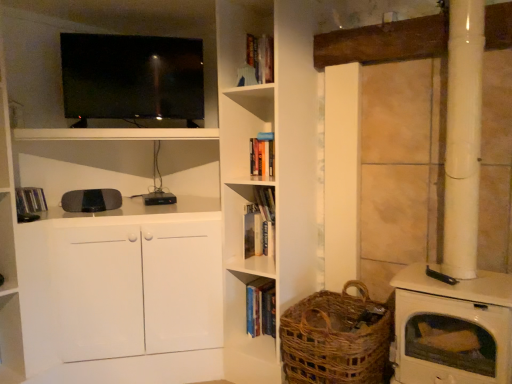
Image resolution: width=512 pixels, height=384 pixels. What do you see at coordinates (30, 200) in the screenshot?
I see `hardcover book at left, which is the 3th book in right-to-left order` at bounding box center [30, 200].

What do you see at coordinates (260, 224) in the screenshot? This screenshot has height=384, width=512. I see `hardcover book at center, which ranks as the second book in left-to-right order` at bounding box center [260, 224].

Describe the element at coordinates (335, 338) in the screenshot. This screenshot has height=384, width=512. I see `woven brown basket at lower right` at that location.

Describe the element at coordinates (131, 76) in the screenshot. This screenshot has height=384, width=512. I see `matte black tv at upper left` at that location.

This screenshot has height=384, width=512. I want to click on hardcover book at left, positioned as the first book in top-to-bottom order, so click(30, 200).

Which is more to the left, hardcover book at center, the second book in the bottom-to-top sequence, or hardcover book at left, positioned as the first book in top-to-bottom order?

hardcover book at left, positioned as the first book in top-to-bottom order, is more to the left.

Is point (266, 242) behind point (41, 200)?

That is True.

From a real-world perspective, which object stands above the other?

hardcover book at left, acting as the 1th book starting from the left, is physically above.

Image resolution: width=512 pixels, height=384 pixels. Identify the location of book above the hardcover book at center, which is the 2th book from top to bottom (from a real-world perspective). (30, 200).

The image size is (512, 384). I want to click on book that is the 1st one above the hardcover book at center, the third book positioned from the top (from a real-world perspective), so click(x=260, y=224).

From the image's perspective, relative to hardcover book at center, the 2th book viewed from the right, is hardcover book at center, the third book positioned from the top, above or below?

Based on their image positions, hardcover book at center, the third book positioned from the top, is located beneath hardcover book at center, the 2th book viewed from the right.

Is hardcover book at center, marked as the 1th book in a right-to-left arrangement, directly adjacent to hardcover book at center, the 2th book viewed from the right?

hardcover book at center, marked as the 1th book in a right-to-left arrangement, and hardcover book at center, the 2th book viewed from the right, are not in contact.

Can you tell me how much hardcover book at center, the first book from the bottom, and hardcover book at center, which ranks as the second book in left-to-right order, differ in facing direction?

The facing directions of hardcover book at center, the first book from the bottom, and hardcover book at center, which ranks as the second book in left-to-right order, are 1.09 degrees apart.

Does matte black tv at upper left have a greater height compared to hardcover book at center, the 3th book from the left?

Correct, matte black tv at upper left is much taller as hardcover book at center, the 3th book from the left.

From the picture: How many degrees apart are the facing directions of matte black tv at upper left and hardcover book at center, the third book positioned from the top?

They differ by 46.9 degrees in their facing directions.

Could you tell me if matte black tv at upper left is turned towards hardcover book at center, the first book from the bottom?

No.

In terms of width, does matte black tv at upper left look wider or thinner when compared to hardcover book at center, the first book from the bottom?

Considering their sizes, matte black tv at upper left looks broader than hardcover book at center, the first book from the bottom.

Does hardcover book at left, the 3th book from the bottom, turn towards woven brown basket at lower right?

No, hardcover book at left, the 3th book from the bottom, is not oriented towards woven brown basket at lower right.

Is hardcover book at left, positioned as the first book in top-to-bottom order, thinner than woven brown basket at lower right?

Yes, hardcover book at left, positioned as the first book in top-to-bottom order, is thinner than woven brown basket at lower right.

From the image's perspective, who appears lower, hardcover book at left, the 3th book from the bottom, or woven brown basket at lower right?

woven brown basket at lower right is shown below in the image.

Is hardcover book at left, positioned as the first book in top-to-bottom order, spatially inside woven brown basket at lower right, or outside of it?

hardcover book at left, positioned as the first book in top-to-bottom order, exists outside the volume of woven brown basket at lower right.

Considering the relative positions of matte black tv at upper left and woven brown basket at lower right in the image provided, is matte black tv at upper left to the left or to the right of woven brown basket at lower right?

matte black tv at upper left is positioned on woven brown basket at lower right's left side.

Considering the sizes of matte black tv at upper left and woven brown basket at lower right in the image, is matte black tv at upper left taller or shorter than woven brown basket at lower right?

Clearly, matte black tv at upper left is taller compared to woven brown basket at lower right.

Does matte black tv at upper left have a greater width compared to woven brown basket at lower right?

No, matte black tv at upper left is not wider than woven brown basket at lower right.

Between point (85, 62) and point (379, 328), which one is positioned behind?

The point (85, 62) is farther.

In the scene shown: Between woven brown basket at lower right and hardcover book at center, the 3th book from the left, which one has larger size?

Bigger between the two is woven brown basket at lower right.

Is hardcover book at center, the third book positioned from the top, located within woven brown basket at lower right?

No, hardcover book at center, the third book positioned from the top, is located outside of woven brown basket at lower right.

Considering the sizes of woven brown basket at lower right and hardcover book at center, the first book from the bottom, in the image, is woven brown basket at lower right taller or shorter than hardcover book at center, the first book from the bottom,?

woven brown basket at lower right is taller than hardcover book at center, the first book from the bottom.

Does woven brown basket at lower right appear on the left side of hardcover book at center, the 3th book from the left?

No.

Which object is thinner, woven brown basket at lower right or hardcover book at left, the 3th book from the bottom?

Thinner between the two is hardcover book at left, the 3th book from the bottom.

Is woven brown basket at lower right spatially inside hardcover book at left, the 3th book from the bottom, or outside of it?

woven brown basket at lower right is outside hardcover book at left, the 3th book from the bottom.

Where is `the 2nd book above the woven brown basket at lower right (from the image's perspective)`? Image resolution: width=512 pixels, height=384 pixels. the 2nd book above the woven brown basket at lower right (from the image's perspective) is located at coordinates (30, 200).

From the image's perspective, is woven brown basket at lower right above hardcover book at left, acting as the 1th book starting from the left?

Actually, woven brown basket at lower right appears below hardcover book at left, acting as the 1th book starting from the left, in the image.

Where is `the 1st book below the hardcover book at left, positioned as the first book in top-to-bottom order (from the image's perspective)`? the 1st book below the hardcover book at left, positioned as the first book in top-to-bottom order (from the image's perspective) is located at coordinates (260, 224).

This screenshot has height=384, width=512. Find the location of `book behind the hardcover book at center, the second book in the bottom-to-top sequence`. book behind the hardcover book at center, the second book in the bottom-to-top sequence is located at coordinates (261, 307).

Which object lies nearer to the anchor point hardcover book at left, the 3th book from the bottom, hardcover book at center, which is the 2th book from top to bottom, or matte black tv at upper left?

matte black tv at upper left is closer to hardcover book at left, the 3th book from the bottom.

From the image, which object appears to be farther from hardcover book at center, marked as the 1th book in a right-to-left arrangement, hardcover book at left, which is the 3th book in right-to-left order, or hardcover book at center, which is the 2th book from top to bottom?

hardcover book at left, which is the 3th book in right-to-left order, is positioned further to the anchor hardcover book at center, marked as the 1th book in a right-to-left arrangement.

When comparing their distances from woven brown basket at lower right, does hardcover book at left, the 3th book from the bottom, or matte black tv at upper left seem closer?

Among the two, matte black tv at upper left is located nearer to woven brown basket at lower right.

Which object lies nearer to the anchor point matte black tv at upper left, hardcover book at left, acting as the 1th book starting from the left, or hardcover book at center, the third book positioned from the top?

Among the two, hardcover book at left, acting as the 1th book starting from the left, is located nearer to matte black tv at upper left.

Based on their spatial positions, is woven brown basket at lower right or matte black tv at upper left further from hardcover book at center, which ranks as the second book in left-to-right order?

matte black tv at upper left is further to hardcover book at center, which ranks as the second book in left-to-right order.

When comparing their distances from matte black tv at upper left, does woven brown basket at lower right or hardcover book at center, the 3th book from the left, seem closer?

hardcover book at center, the 3th book from the left, lies closer to matte black tv at upper left than the other object.

Which object lies further to the anchor point hardcover book at left, the 3th book from the bottom, hardcover book at center, the 3th book from the left, or hardcover book at center, which is the 2th book from top to bottom?

Among the two, hardcover book at center, the 3th book from the left, is located further to hardcover book at left, the 3th book from the bottom.

Looking at the image, which one is located closer to woven brown basket at lower right, hardcover book at center, marked as the 1th book in a right-to-left arrangement, or hardcover book at left, the 3th book from the bottom?

hardcover book at center, marked as the 1th book in a right-to-left arrangement, lies closer to woven brown basket at lower right than the other object.

Identify the location of television between hardcover book at left, positioned as the first book in top-to-bottom order, and hardcover book at center, the 2th book viewed from the right, in the horizontal direction. The image size is (512, 384). (131, 76).

You are a GUI agent. You are given a task and a screenshot of the screen. Output one action in this format:
    pyautogui.click(x=<x>, y=<y>)
    Task: Click on the television located between hardcover book at left, positioned as the first book in top-to-bottom order, and woven brown basket at lower right in the left-right direction
    The width and height of the screenshot is (512, 384).
    Given the screenshot: What is the action you would take?
    coord(131,76)

In order to click on basket between matte black tv at upper left and hardcover book at center, marked as the 1th book in a right-to-left arrangement, in the up-down direction in this screenshot , I will do `click(335, 338)`.

Identify the location of television between hardcover book at left, the 3th book from the bottom, and hardcover book at center, the third book positioned from the top, in the horizontal direction. This screenshot has height=384, width=512. (131, 76).